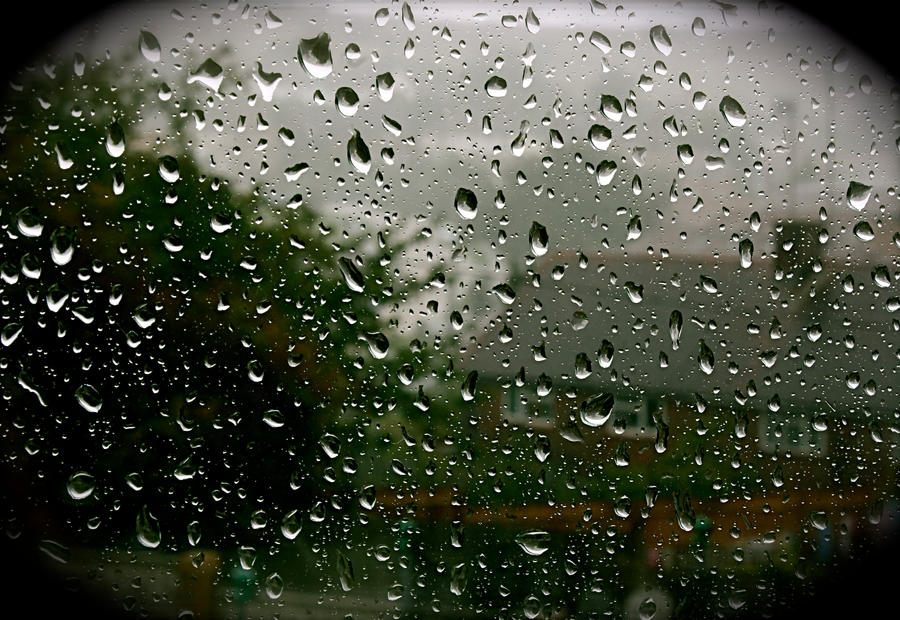
Locate an element on the screen. chimney is located at coordinates (805, 240).